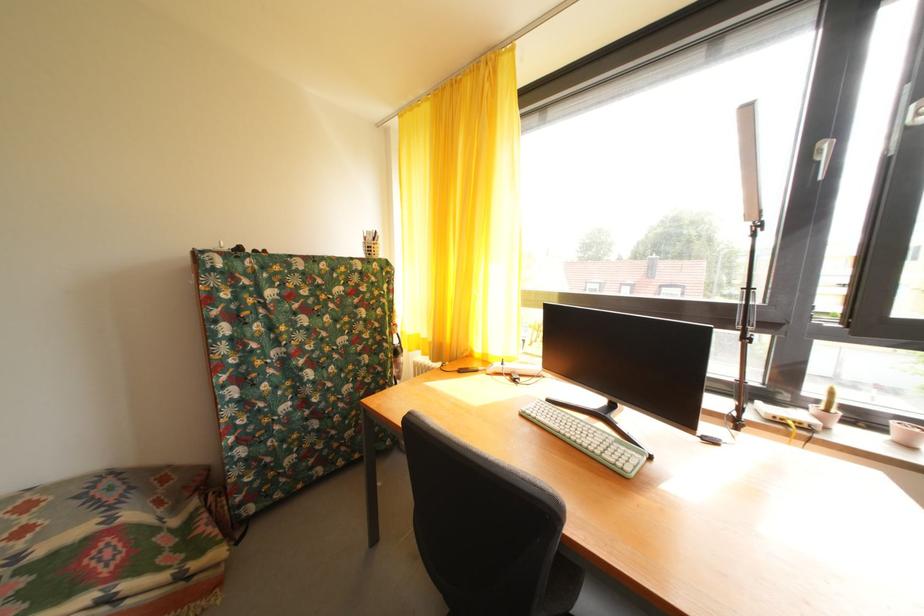
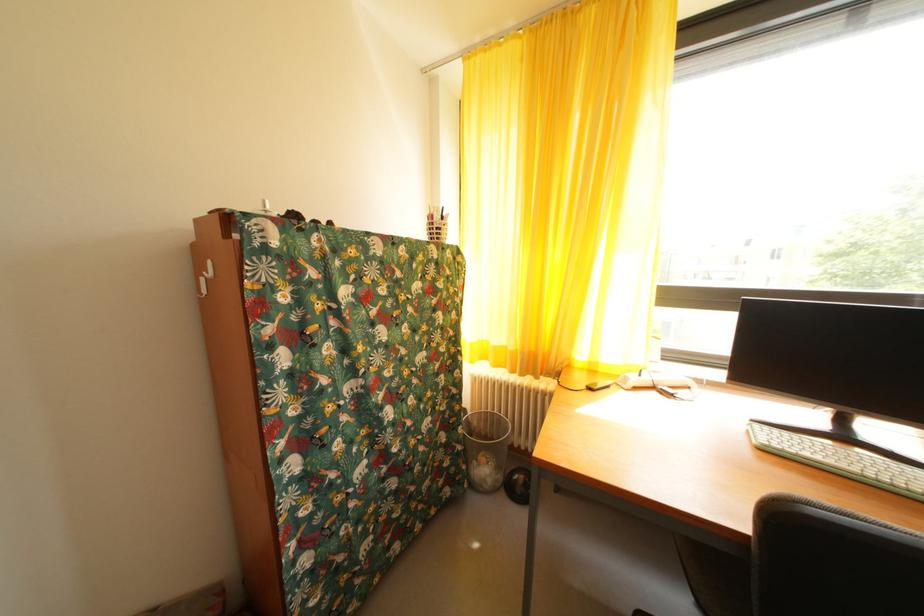
The point at (373, 245) is marked in the first image. Where is the corresponding point in the second image?

(440, 223)